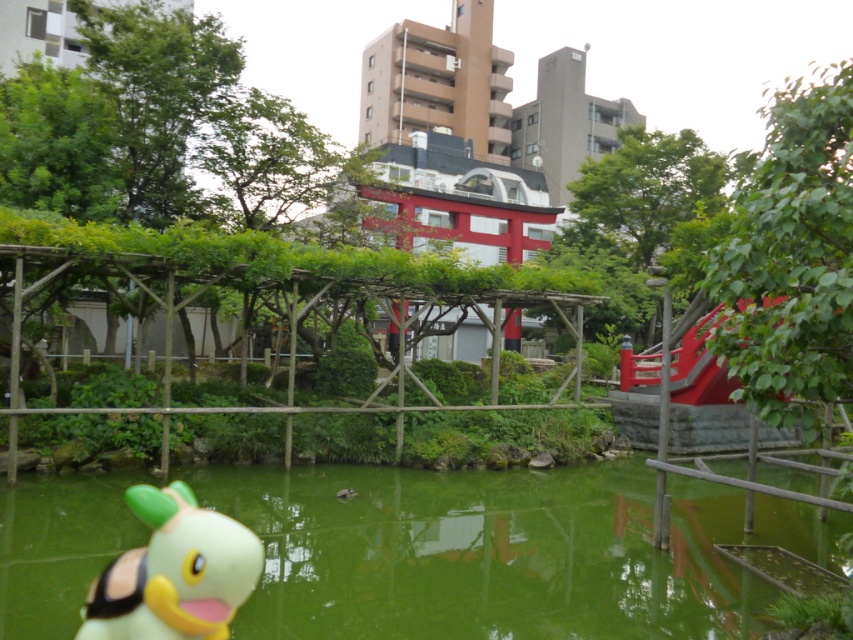
Question: Which object is positioned farthest from the green liquid water at center?

Choices:
 (A) wooden trellis at center
 (B) yellow matte plush toy at lower left

Answer: (B)

Question: Observing the image, what is the correct spatial positioning of green liquid water at center in reference to yellow matte plush toy at lower left?

Choices:
 (A) below
 (B) above

Answer: (A)

Question: Which object is farther from the camera taking this photo?

Choices:
 (A) green liquid water at center
 (B) wooden trellis at center
 (C) yellow matte plush toy at lower left

Answer: (B)

Question: Can you confirm if green liquid water at center is positioned above wooden trellis at center?

Choices:
 (A) no
 (B) yes

Answer: (A)

Question: Which of the following is the closest to the observer?

Choices:
 (A) (648, 576)
 (B) (120, 564)

Answer: (B)

Question: Does green liquid water at center appear under yellow matte plush toy at lower left?

Choices:
 (A) no
 (B) yes

Answer: (B)